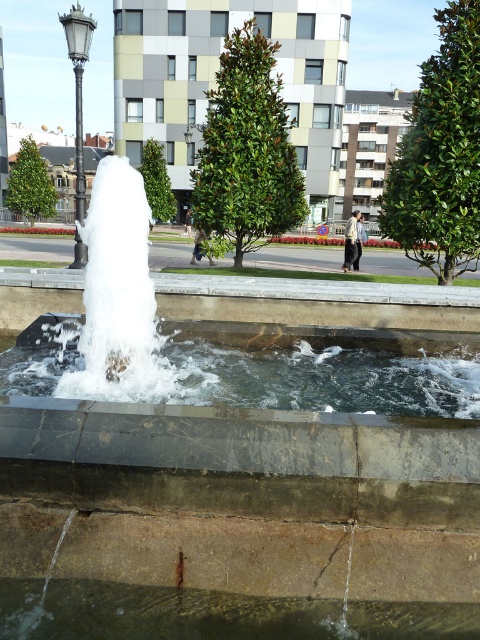
Image resolution: width=480 pixels, height=640 pixels. Identify the location of clear water at center. (320, 371).

Is point (349, 340) positioned before point (82, 74)?

Yes, point (349, 340) is in front of point (82, 74).

Which is in front, point (136, 397) or point (78, 20)?

Positioned in front is point (136, 397).

What are the coordinates of `clear water at center` in the screenshot? It's located at (320, 371).